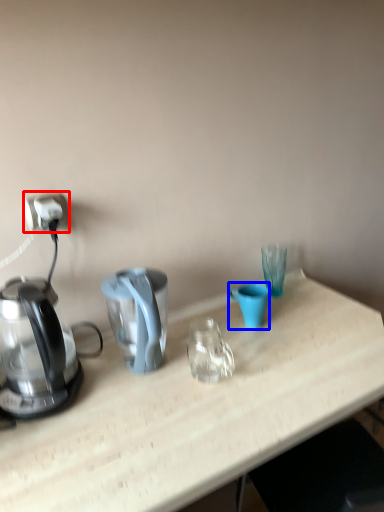
Question: Which point is closer to the camera, power outlet (highlighted by a red box) or coffee cup (highlighted by a blue box)?

Choices:
 (A) power outlet
 (B) coffee cup

Answer: (A)